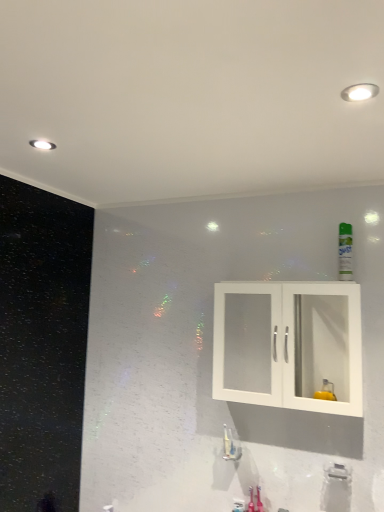
Question: Can you confirm if green matte mouthwash at upper right is smaller than white plastic faucet at lower center, which is counted as the first plumbing fixture, starting from the right?

Choices:
 (A) yes
 (B) no

Answer: (B)

Question: Does green matte mouthwash at upper right turn towards white plastic faucet at lower center, which is the first plumbing fixture from front to back?

Choices:
 (A) no
 (B) yes

Answer: (A)

Question: Is green matte mouthwash at upper right positioned beyond the bounds of white plastic faucet at lower center, acting as the 2th plumbing fixture starting from the top?

Choices:
 (A) yes
 (B) no

Answer: (A)

Question: From the image's perspective, would you say green matte mouthwash at upper right is shown under white plastic faucet at lower center, which is counted as the first plumbing fixture, starting from the right?

Choices:
 (A) no
 (B) yes

Answer: (A)

Question: Is green matte mouthwash at upper right placed right next to white plastic faucet at lower center, which is the first plumbing fixture from front to back?

Choices:
 (A) no
 (B) yes

Answer: (A)

Question: Is green matte mouthwash at upper right not near white plastic faucet at lower center, which is counted as the first plumbing fixture, starting from the right?

Choices:
 (A) no
 (B) yes

Answer: (A)

Question: Is white matte cabinet at center facing towards green matte mouthwash at upper right?

Choices:
 (A) yes
 (B) no

Answer: (B)

Question: Does white matte cabinet at center come behind green matte mouthwash at upper right?

Choices:
 (A) no
 (B) yes

Answer: (A)

Question: Is white matte cabinet at center closer to the viewer compared to green matte mouthwash at upper right?

Choices:
 (A) yes
 (B) no

Answer: (A)

Question: Would you say white matte cabinet at center is a long distance from green matte mouthwash at upper right?

Choices:
 (A) no
 (B) yes

Answer: (A)

Question: Considering the relative sizes of white matte cabinet at center and green matte mouthwash at upper right in the image provided, is white matte cabinet at center thinner than green matte mouthwash at upper right?

Choices:
 (A) yes
 (B) no

Answer: (B)

Question: Can you confirm if white matte cabinet at center is bigger than green matte mouthwash at upper right?

Choices:
 (A) no
 (B) yes

Answer: (B)

Question: Does white matte cabinet at center turn towards white glossy faucet at lower center, marked as the 2th plumbing fixture in a right-to-left arrangement?

Choices:
 (A) yes
 (B) no

Answer: (B)